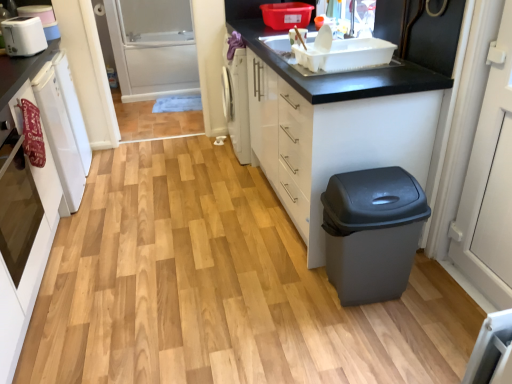
Identify the location of free location to the right of matte gray plastic trash can at lower right. (436, 302).